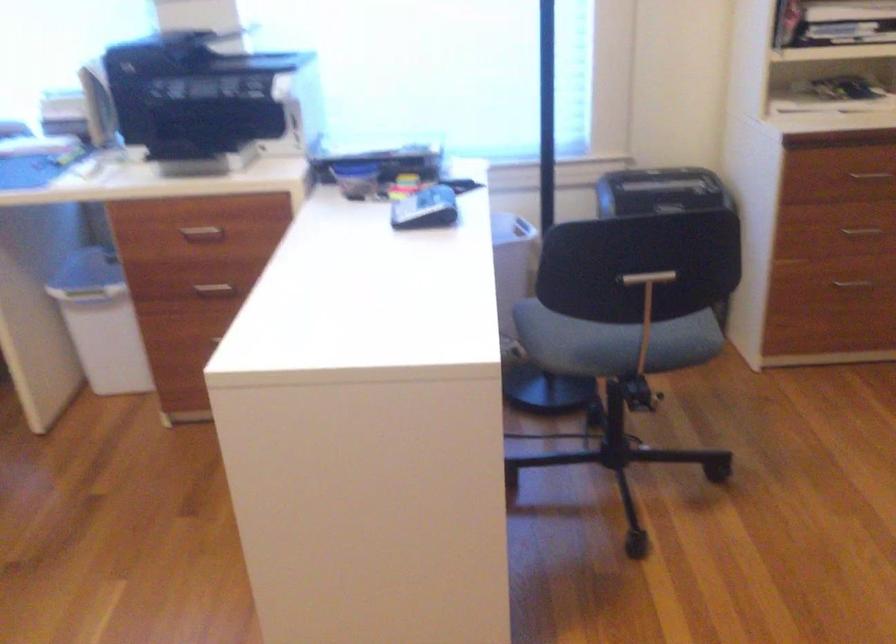
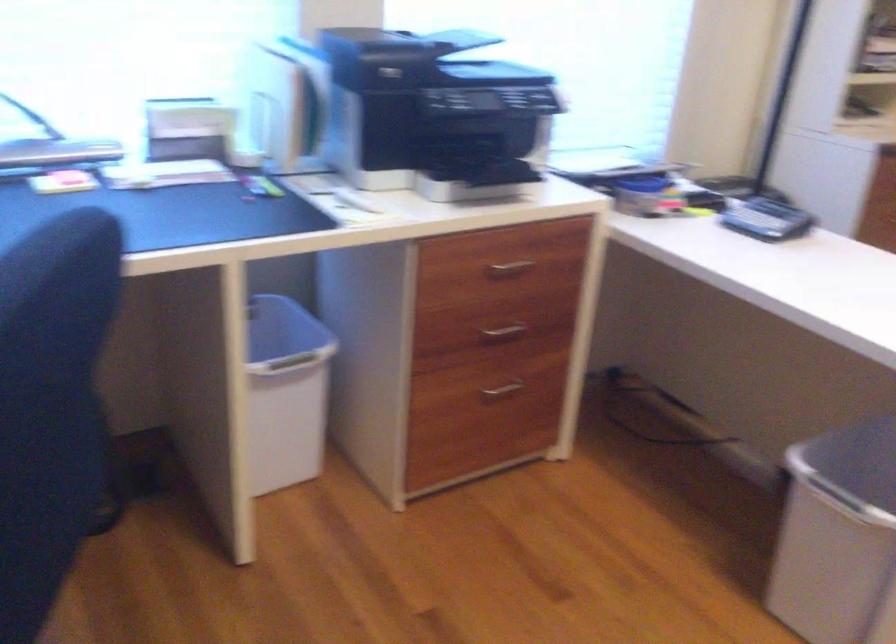
In the second image, find the point that corresponds to pixel 224 287 in the first image.

(503, 330)